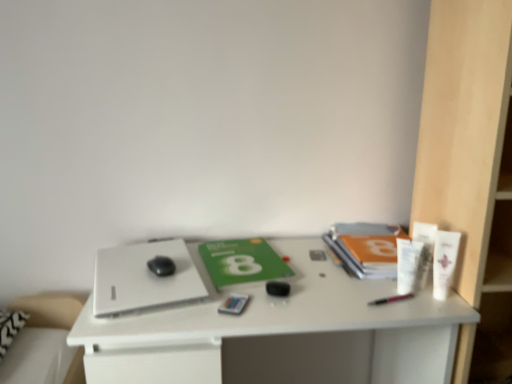
Find the location of `vacant space in front of green matte paperback book at center, the first paperback book viewed from the left`. vacant space in front of green matte paperback book at center, the first paperback book viewed from the left is located at coordinates (256, 310).